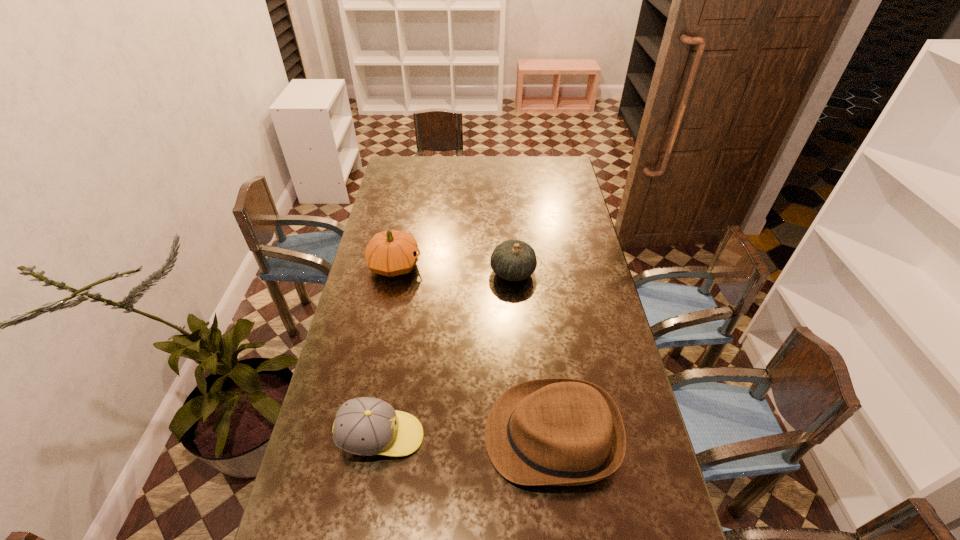
Image resolution: width=960 pixels, height=540 pixels. Find the location of `empty location between the shorter gourd and the baseball cap`. empty location between the shorter gourd and the baseball cap is located at coordinates (446, 354).

In order to click on free space between the fedora and the taller gourd in this screenshot , I will do `click(473, 350)`.

The image size is (960, 540). What are the coordinates of `free space between the shorter gourd and the fedora` in the screenshot? It's located at (532, 354).

Locate an element on the screen. The image size is (960, 540). free space between the fedora and the shorter gourd is located at coordinates (532, 354).

Where is `free spot between the left gourd and the shorter gourd`? The image size is (960, 540). free spot between the left gourd and the shorter gourd is located at coordinates (454, 269).

Image resolution: width=960 pixels, height=540 pixels. What are the coordinates of `empty location between the baseball cap and the right gourd` in the screenshot? It's located at (446, 354).

Locate an element on the screen. This screenshot has height=540, width=960. empty space that is in between the fedora and the baseball cap is located at coordinates (467, 436).

Point out which object is positioned as the second nearest to the right gourd. Please provide its 2D coordinates. Your answer should be formatted as a tuple, i.e. [(x, y)], where the tuple contains the x and y coordinates of a point satisfying the conditions above.

[(556, 431)]

Where is `object identified as the third closest to the shorter gourd`? Image resolution: width=960 pixels, height=540 pixels. object identified as the third closest to the shorter gourd is located at coordinates (365, 426).

Locate an element on the screen. The width and height of the screenshot is (960, 540). vacant space that satisfies the following two spatial constraints: 1. on the front side of the right gourd; 2. on the front-facing side of the baseball cap is located at coordinates (525, 437).